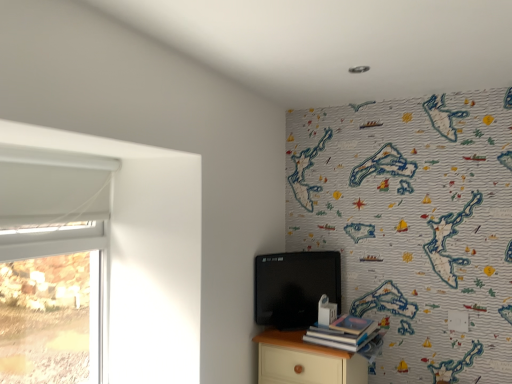
This screenshot has width=512, height=384. Describe the element at coordinates (305, 361) in the screenshot. I see `light wood nightstand at lower right` at that location.

The width and height of the screenshot is (512, 384). Describe the element at coordinates (294, 287) in the screenshot. I see `matte black tv at center` at that location.

Where is `light wood nightstand at lower right`? The image size is (512, 384). light wood nightstand at lower right is located at coordinates (305, 361).

Are light wood nightstand at lower right and hardcover book at lower right far apart?

No, light wood nightstand at lower right is not far from hardcover book at lower right.

Is light wood nightstand at lower right shorter than hardcover book at lower right?

No, light wood nightstand at lower right is not shorter than hardcover book at lower right.

Is light wood nightstand at lower right oriented away from hardcover book at lower right?

No, hardcover book at lower right is not at the back of light wood nightstand at lower right.

Does light wood nightstand at lower right come behind hardcover book at lower right?

Yes, light wood nightstand at lower right is behind hardcover book at lower right.

Can you confirm if light wood nightstand at lower right is wider than white plastic window at left?

Correct, the width of light wood nightstand at lower right exceeds that of white plastic window at left.

Which of these two, light wood nightstand at lower right or white plastic window at left, is smaller?

white plastic window at left.

Is light wood nightstand at lower right not close to white plastic window at left?

No, light wood nightstand at lower right is not far away from white plastic window at left.

From a real-world perspective, is white plastic window at left over light wood nightstand at lower right?

Yes, from a real-world perspective, white plastic window at left is over light wood nightstand at lower right

Consider the image. Does white plastic window at left have a smaller size compared to light wood nightstand at lower right?

Yes, white plastic window at left is smaller than light wood nightstand at lower right.

Can you confirm if white plastic window at left is positioned to the left of light wood nightstand at lower right?

Yes.

Is white plastic window at left turned away from light wood nightstand at lower right?

No, light wood nightstand at lower right is not at the back of white plastic window at left.

Considering the relative positions of matte black tv at center and light wood nightstand at lower right in the image provided, is matte black tv at center to the left or to the right of light wood nightstand at lower right?

In the image, matte black tv at center appears on the left side of light wood nightstand at lower right.

From the image's perspective, which is above, matte black tv at center or light wood nightstand at lower right?

From the image's view, matte black tv at center is above.

Could you tell me if matte black tv at center is facing light wood nightstand at lower right?

No, matte black tv at center is not aimed at light wood nightstand at lower right.

Based on the photo, does matte black tv at center have a smaller size compared to light wood nightstand at lower right?

Correct, matte black tv at center occupies less space than light wood nightstand at lower right.

This screenshot has width=512, height=384. Find the location of `computer below the white plastic window at left (from a real-world perspective)`. computer below the white plastic window at left (from a real-world perspective) is located at coordinates (294, 287).

Which of these two, white plastic window at left or matte black tv at center, stands taller?

white plastic window at left is taller.

From a real-world perspective, is white plastic window at left beneath matte black tv at center?

No, from a real-world perspective, white plastic window at left is not beneath matte black tv at center.

Would you say white plastic window at left is a long distance from matte black tv at center?

No, white plastic window at left is in close proximity to matte black tv at center.

From the image's perspective, is hardcover book at lower right above matte black tv at center?

No.

I want to click on book lying below the matte black tv at center (from the image's perspective), so click(x=343, y=334).

Is hardcover book at lower right looking in the opposite direction of matte black tv at center?

No, matte black tv at center is not at the back of hardcover book at lower right.

Can you see hardcover book at lower right touching white plastic window at left?

There is a gap between hardcover book at lower right and white plastic window at left.

Which object is wider, hardcover book at lower right or white plastic window at left?

Wider between the two is hardcover book at lower right.

Could white plastic window at left be considered to be inside hardcover book at lower right?

No.

What are the coordinates of `nightstand below the hardcover book at lower right (from the image's perspective)` in the screenshot? It's located at (305, 361).

Where is `window lying on the left of light wood nightstand at lower right`? window lying on the left of light wood nightstand at lower right is located at coordinates (51, 307).

From the image, which object appears to be farther from matte black tv at center, white plastic window at left or light wood nightstand at lower right?

Based on the image, white plastic window at left appears to be further to matte black tv at center.

Estimate the real-world distances between objects in this image. Which object is closer to light wood nightstand at lower right, white plastic window at left or hardcover book at lower right?

hardcover book at lower right is closer to light wood nightstand at lower right.

Looking at the image, which one is located closer to hardcover book at lower right, matte black tv at center or light wood nightstand at lower right?

light wood nightstand at lower right.

From the image, which object appears to be nearer to light wood nightstand at lower right, white plastic window at left or matte black tv at center?

matte black tv at center lies closer to light wood nightstand at lower right than the other object.

When comparing their distances from light wood nightstand at lower right, does hardcover book at lower right or matte black tv at center seem further?

matte black tv at center is further to light wood nightstand at lower right.

In the scene shown: Which object lies further to the anchor point matte black tv at center, white plastic window at left or hardcover book at lower right?

Based on the image, white plastic window at left appears to be further to matte black tv at center.

Based on their spatial positions, is hardcover book at lower right or white plastic window at left closer to light wood nightstand at lower right?

hardcover book at lower right.

Estimate the real-world distances between objects in this image. Which object is closer to matte black tv at center, hardcover book at lower right or light wood nightstand at lower right?

The object closer to matte black tv at center is light wood nightstand at lower right.

This screenshot has height=384, width=512. In order to click on nightstand between white plastic window at left and hardcover book at lower right from left to right in this screenshot , I will do `click(305, 361)`.

Locate an element on the screen. computer located between white plastic window at left and light wood nightstand at lower right in the left-right direction is located at coordinates (294, 287).

Locate an element on the screen. The height and width of the screenshot is (384, 512). book between matte black tv at center and light wood nightstand at lower right in the up-down direction is located at coordinates [x=343, y=334].

This screenshot has height=384, width=512. Identify the location of computer situated between white plastic window at left and hardcover book at lower right from left to right. (294, 287).